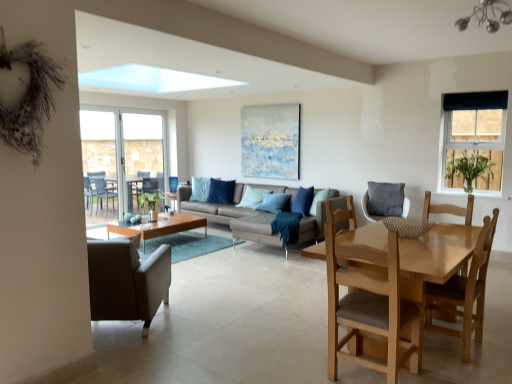
Describe the element at coordinates (140, 150) in the screenshot. I see `clear glass door at left, placed as the 2th screen door when sorted from left to right` at that location.

What do you see at coordinates (303, 201) in the screenshot?
I see `blue velvet pillow at center, the 3th pillow when ordered from back to front` at bounding box center [303, 201].

What is the approximate width of light blue fabric pillow at center, arranged as the second pillow when viewed from the front?

It is 12.41 inches.

What do you see at coordinates (252, 197) in the screenshot? The image size is (512, 384). I see `light blue fabric pillow at center, positioned as the 2th pillow in right-to-left order` at bounding box center [252, 197].

At what (x,y) coordinates should I click in order to perform the action: click on dark blue fabric curtain at upper right, the 2th window viewed from the left. Please return your answer as a coordinate pair (x, y). The height and width of the screenshot is (384, 512). Looking at the image, I should click on (474, 140).

What is the approximate width of dark blue fabric curtain at upper right, the 2th window viewed from the left?

It is 8.38 centimeters.

Locate an element on the screen. clear glass door at left, placed as the 1th screen door when sorted from right to left is located at coordinates (140, 150).

Consider the image. Does gray fabric cushion at center, the first chair viewed from the back, lie in front of matte wood coffee table at center?

No, gray fabric cushion at center, the first chair viewed from the back, is behind matte wood coffee table at center.

How many degrees apart are the facing directions of gray fabric cushion at center, the 4th chair viewed from the front, and matte wood coffee table at center?

The angular difference between gray fabric cushion at center, the 4th chair viewed from the front, and matte wood coffee table at center is 69 degrees.

Is gray fabric cushion at center, the first chair viewed from the back, not within matte wood coffee table at center?

Indeed, gray fabric cushion at center, the first chair viewed from the back, is completely outside matte wood coffee table at center.

From a real-world perspective, which object rests below the other?

From a 3D spatial view, clear glass door at left, placed as the 2th screen door when sorted from left to right, is below.

Find the location of `the 1st screen door counting from the left side of the textured canvas painting at upper center`. the 1st screen door counting from the left side of the textured canvas painting at upper center is located at coordinates (140, 150).

Does textured canvas painting at upper center appear on the left side of clear glass door at left, placed as the 2th screen door when sorted from left to right?

In fact, textured canvas painting at upper center is to the right of clear glass door at left, placed as the 2th screen door when sorted from left to right.

From the picture: Is green glass vase at upper right oriented towards dark blue fabric at upper right?

No, green glass vase at upper right is not oriented towards dark blue fabric at upper right.

From the image's perspective, is green glass vase at upper right over dark blue fabric at upper right?

Actually, green glass vase at upper right appears below dark blue fabric at upper right in the image.

From a real-world perspective, is green glass vase at upper right physically below dark blue fabric at upper right?

Yes.

Who is shorter, green glass vase at upper right or dark blue fabric at upper right?

dark blue fabric at upper right.

Is blue velvet pillow at center, the 3th pillow positioned from the right, with light brown wooden chair at lower right, the 1th chair positioned from the front?

No, blue velvet pillow at center, the 3th pillow positioned from the right, is not next to light brown wooden chair at lower right, the 1th chair positioned from the front.

From a real-world perspective, which is physically below, blue velvet pillow at center, the first pillow positioned from the back, or light brown wooden chair at lower right, which is counted as the fourth chair, starting from the back?

In real-world perspective, light brown wooden chair at lower right, which is counted as the fourth chair, starting from the back, is lower.

Is blue velvet pillow at center, the 3th pillow positioned from the right, facing away from light brown wooden chair at lower right, marked as the 3th chair in a right-to-left arrangement?

No, blue velvet pillow at center, the 3th pillow positioned from the right, is not facing away from light brown wooden chair at lower right, marked as the 3th chair in a right-to-left arrangement.

Which object is positioned more to the right, blue velvet pillow at center, marked as the first pillow in a left-to-right arrangement, or light brown wooden chair at lower right, positioned as the second chair in left-to-right order?

Positioned to the right is light brown wooden chair at lower right, positioned as the second chair in left-to-right order.

Would you say textured canvas painting at upper center is inside or outside dark blue fabric at upper right?

textured canvas painting at upper center exists outside the volume of dark blue fabric at upper right.

From a real-world perspective, is textured canvas painting at upper center under dark blue fabric at upper right?

Indeed, from a real-world perspective, textured canvas painting at upper center is positioned beneath dark blue fabric at upper right.

Which is farther from the camera, (x=257, y=128) or (x=429, y=322)?

The point (x=257, y=128) is behind.

How many degrees apart are the facing directions of textured canvas painting at upper center and light brown wooden chair at lower right, placed as the 3th chair when sorted from left to right?

They differ by 89.1 degrees in their facing directions.

Is textured canvas painting at upper center to the left or to the right of light brown wooden chair at lower right, placed as the 2th chair when sorted from right to left, in the image?

Based on their positions, textured canvas painting at upper center is located to the left of light brown wooden chair at lower right, placed as the 2th chair when sorted from right to left.

Can you confirm if textured canvas painting at upper center is thinner than light brown wooden chair at lower right, placed as the 2th chair when sorted from right to left?

Indeed, textured canvas painting at upper center has a lesser width compared to light brown wooden chair at lower right, placed as the 2th chair when sorted from right to left.

Which is behind, leather couch at center or blue velvet pillow at center, the first pillow positioned from the back?

blue velvet pillow at center, the first pillow positioned from the back, is further away from the camera.

Is leather couch at center facing away from blue velvet pillow at center, marked as the 3th pillow in a front-to-back arrangement?

Absolutely, leather couch at center is directed away from blue velvet pillow at center, marked as the 3th pillow in a front-to-back arrangement.

Based on the photo, which is more to the right, leather couch at center or blue velvet pillow at center, the 3th pillow positioned from the right?

Positioned to the right is leather couch at center.

Is leather couch at center touching blue velvet pillow at center, the first pillow positioned from the back?

No, leather couch at center is not touching blue velvet pillow at center, the first pillow positioned from the back.

Where is `coffee table that is under the gray fabric cushion at center, the first chair viewed from the back (from a real-world perspective)`? coffee table that is under the gray fabric cushion at center, the first chair viewed from the back (from a real-world perspective) is located at coordinates (159, 226).

You are a GUI agent. You are given a task and a screenshot of the screen. Output one action in this format:
    pyautogui.click(x=<x>, y=<y>)
    Task: Click on the picture frame on the right of clear glass door at left, placed as the 2th screen door when sorted from left to right
    
    Given the screenshot: What is the action you would take?
    pyautogui.click(x=270, y=141)

Which object lies further to the anchor point light brown wooden chair at lower right, positioned as the 3th chair in back-to-front order, clear glass door at left, placed as the 2th screen door when sorted from left to right, or light brown wooden chair at lower right, positioned as the second chair in left-to-right order?

Based on the image, clear glass door at left, placed as the 2th screen door when sorted from left to right, appears to be further to light brown wooden chair at lower right, positioned as the 3th chair in back-to-front order.

Estimate the real-world distances between objects in this image. Which object is closer to dark blue fabric at upper right, blue velvet pillow at center, the first pillow positioned from the back, or light brown wooden chair at lower right, marked as the 3th chair in a right-to-left arrangement?

light brown wooden chair at lower right, marked as the 3th chair in a right-to-left arrangement, lies closer to dark blue fabric at upper right than the other object.

Estimate the real-world distances between objects in this image. Which object is closer to dark blue fabric curtain at upper right, marked as the first window in a front-to-back arrangement, leather couch at center or leather armchair at left, placed as the fourth chair when sorted from right to left?

leather couch at center lies closer to dark blue fabric curtain at upper right, marked as the first window in a front-to-back arrangement, than the other object.

Which object lies further to the anchor point light brown wooden chair at lower right, positioned as the 2th chair in front-to-back order, light blue fabric pillow at center, positioned as the 2th pillow in right-to-left order, or green glass vase at upper right?

light blue fabric pillow at center, positioned as the 2th pillow in right-to-left order, is positioned further to the anchor light brown wooden chair at lower right, positioned as the 2th chair in front-to-back order.

Looking at the image, which one is located further to blue velvet pillow at center, the 3th pillow positioned from the right, blue plastic chairs at left, which appears as the second screen door when viewed from the right, or dark blue fabric at upper right?

dark blue fabric at upper right is further to blue velvet pillow at center, the 3th pillow positioned from the right.

From the image, which object appears to be nearer to leather couch at center, light brown wooden chair at lower right, placed as the 3th chair when sorted from left to right, or green glass vase at upper right?

green glass vase at upper right lies closer to leather couch at center than the other object.

Estimate the real-world distances between objects in this image. Which object is closer to leather couch at center, chrome metallic chandelier at upper right or light brown wooden chair at lower right, marked as the 3th chair in a right-to-left arrangement?

Among the two, light brown wooden chair at lower right, marked as the 3th chair in a right-to-left arrangement, is located nearer to leather couch at center.

Looking at the image, which one is located closer to dark blue fabric at upper right, dark blue fabric curtain at upper right, which appears as the first window when viewed from the right, or light brown wooden chair at lower right, which is counted as the fourth chair, starting from the back?

The object closer to dark blue fabric at upper right is dark blue fabric curtain at upper right, which appears as the first window when viewed from the right.

Find the location of a particular element. The height and width of the screenshot is (384, 512). light fixture located between clear glass door at left, placed as the 2th screen door when sorted from left to right, and dark blue fabric at upper right in the left-right direction is located at coordinates (487, 16).

At what (x,y) coordinates should I click in order to perform the action: click on studio couch between light brown wooden chair at lower right, placed as the 2th chair when sorted from right to left, and gray fabric cushion at center, the 4th chair viewed from the front, from front to back. Please return your answer as a coordinate pair (x, y). This screenshot has width=512, height=384. Looking at the image, I should click on (231, 218).

You are a GUI agent. You are given a task and a screenshot of the screen. Output one action in this format:
    pyautogui.click(x=<x>, y=<y>)
    Task: Click on the studio couch between light brown wooden chair at lower right, placed as the 2th chair when sorted from right to left, and blue plastic chairs at left, which is the 1th screen door from left to right, in the front-back direction
    This screenshot has width=512, height=384.
    Given the screenshot: What is the action you would take?
    pyautogui.click(x=231, y=218)

Locate an element on the screen. This screenshot has height=384, width=512. coffee table positioned between chrome metallic chandelier at upper right and clear glass door at left, placed as the 1th screen door when sorted from right to left, from near to far is located at coordinates (159, 226).